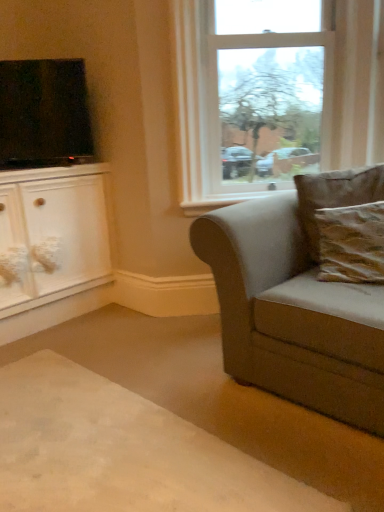
Where is `matte black tv at upper left`? The height and width of the screenshot is (512, 384). matte black tv at upper left is located at coordinates (44, 114).

Find the location of a particular element. This screenshot has height=512, width=384. clear glass window at upper center is located at coordinates (254, 95).

Find the location of a particular element. The width and height of the screenshot is (384, 512). white fabric drawer at lower left is located at coordinates (13, 251).

The width and height of the screenshot is (384, 512). Identify the location of brown textured pillow at right, the 2th pillow positioned from the back. (351, 243).

The height and width of the screenshot is (512, 384). In order to click on carpet at lower left in this screenshot , I will do `click(123, 451)`.

The width and height of the screenshot is (384, 512). What do you see at coordinates (123, 451) in the screenshot? I see `carpet at lower left` at bounding box center [123, 451].

The width and height of the screenshot is (384, 512). I want to click on brown textured pillow at right, which appears as the first pillow when viewed from the back, so click(x=335, y=196).

At what (x,y) coordinates should I click in order to perform the action: click on matte black tv at upper left. Please return your answer as a coordinate pair (x, y). This screenshot has height=512, width=384. Looking at the image, I should click on (44, 114).

Is clear glass window at upper center shorter than suede-like gray couch at right?

In fact, clear glass window at upper center may be taller than suede-like gray couch at right.

Find the location of a particular element. The width and height of the screenshot is (384, 512). studio couch in front of the clear glass window at upper center is located at coordinates (297, 301).

Choose the correct answer: Is clear glass window at upper center inside suede-like gray couch at right or outside it?

clear glass window at upper center is not enclosed by suede-like gray couch at right.

Could you tell me if white glossy cabinet at left is turned towards carpet at lower left?

Yes, white glossy cabinet at left is turned towards carpet at lower left.

Does white glossy cabinet at left touch carpet at lower left?

No.

Is point (95, 257) positioned after point (11, 412)?

That is True.

Does white glossy cabinet at left lie in front of carpet at lower left?

No, white glossy cabinet at left is further to the viewer.

In the scene shown: Do you think brown textured pillow at right, the 2th pillow positioned from the back, is within brown textured pillow at right, which appears as the first pillow when viewed from the back, or outside of it?

brown textured pillow at right, the 2th pillow positioned from the back, is contained in brown textured pillow at right, which appears as the first pillow when viewed from the back.

Is brown textured pillow at right, the 2th pillow positioned from the back, oriented towards brown textured pillow at right, which appears as the second pillow when viewed from the front?

No.

Does point (229, 17) appear closer or farther from the camera than point (332, 187)?

Point (229, 17).

Is clear glass window at upper center positioned in front of brown textured pillow at right, which appears as the second pillow when viewed from the front?

No, clear glass window at upper center is behind brown textured pillow at right, which appears as the second pillow when viewed from the front.

Is clear glass window at upper center not within brown textured pillow at right, which appears as the second pillow when viewed from the front?

clear glass window at upper center lies outside brown textured pillow at right, which appears as the second pillow when viewed from the front,'s area.

Based on the photo, is clear glass window at upper center to the right of brown textured pillow at right, which appears as the first pillow when viewed from the back, from the viewer's perspective?

No, clear glass window at upper center is not to the right of brown textured pillow at right, which appears as the first pillow when viewed from the back.

From a real-world perspective, does brown textured pillow at right, which appears as the second pillow when viewed from the front, sit lower than clear glass window at upper center?

Yes.

Measure the distance between brown textured pillow at right, which appears as the first pillow when viewed from the back, and clear glass window at upper center.

brown textured pillow at right, which appears as the first pillow when viewed from the back, is 29.28 inches away from clear glass window at upper center.

In terms of height, does brown textured pillow at right, which appears as the second pillow when viewed from the front, look taller or shorter compared to clear glass window at upper center?

Considering their sizes, brown textured pillow at right, which appears as the second pillow when viewed from the front, has less height than clear glass window at upper center.

Considering the sizes of brown textured pillow at right, which appears as the first pillow when viewed from the back, and clear glass window at upper center in the image, is brown textured pillow at right, which appears as the first pillow when viewed from the back, wider or thinner than clear glass window at upper center?

In the image, brown textured pillow at right, which appears as the first pillow when viewed from the back, appears to be wider than clear glass window at upper center.

Looking at this image, which object is more forward, brown textured pillow at right, the 2th pillow positioned from the back, or white fabric drawer at lower left?

brown textured pillow at right, the 2th pillow positioned from the back, is closer to the camera.

Find the location of a particular element. This screenshot has height=512, width=384. drawer behind the brown textured pillow at right, which is the first pillow in front-to-back order is located at coordinates (13, 251).

Is brown textured pillow at right, the 2th pillow positioned from the back, wider or thinner than white fabric drawer at lower left?

Clearly, brown textured pillow at right, the 2th pillow positioned from the back, has more width compared to white fabric drawer at lower left.

Is brown textured pillow at right, which is the first pillow in front-to-back order, beside white fabric drawer at lower left?

No, brown textured pillow at right, which is the first pillow in front-to-back order, is not next to white fabric drawer at lower left.

Which object is positioned more to the right, matte black tv at upper left or brown textured pillow at right, which is the first pillow in front-to-back order?

From the viewer's perspective, brown textured pillow at right, which is the first pillow in front-to-back order, appears more on the right side.

Can you tell me how much matte black tv at upper left and brown textured pillow at right, the 2th pillow positioned from the back, differ in facing direction?

They differ by 24.5 degrees in their facing directions.

Which object is further away from the camera, matte black tv at upper left or brown textured pillow at right, the 2th pillow positioned from the back?

matte black tv at upper left is behind.

Is matte black tv at upper left bigger or smaller than brown textured pillow at right, which is the first pillow in front-to-back order?

Considering their sizes, matte black tv at upper left takes up more space than brown textured pillow at right, which is the first pillow in front-to-back order.

Locate an element on the screen. Image resolution: width=384 pixels, height=512 pixels. window to the left of suede-like gray couch at right is located at coordinates (254, 95).

Locate an element on the screen. This screenshot has width=384, height=512. plain below the white glossy cabinet at left (from the image's perspective) is located at coordinates (123, 451).

Based on their spatial positions, is suede-like gray couch at right or matte black tv at upper left closer to clear glass window at upper center?

The object closer to clear glass window at upper center is suede-like gray couch at right.

From the image, which object appears to be farther from white fabric drawer at lower left, brown textured pillow at right, which appears as the second pillow when viewed from the front, or white glossy cabinet at left?

brown textured pillow at right, which appears as the second pillow when viewed from the front.

Consider the image. When comparing their distances from white glossy cabinet at left, does white fabric drawer at lower left or matte black tv at upper left seem closer?

white fabric drawer at lower left.

Based on their spatial positions, is carpet at lower left or white fabric drawer at lower left closer to brown textured pillow at right, the 2th pillow positioned from the back?

carpet at lower left is closer to brown textured pillow at right, the 2th pillow positioned from the back.

Based on their spatial positions, is white fabric drawer at lower left or suede-like gray couch at right closer to white glossy cabinet at left?

white fabric drawer at lower left lies closer to white glossy cabinet at left than the other object.

When comparing their distances from matte black tv at upper left, does suede-like gray couch at right or brown textured pillow at right, which appears as the first pillow when viewed from the back, seem closer?

Among the two, suede-like gray couch at right is located nearer to matte black tv at upper left.

Estimate the real-world distances between objects in this image. Which object is closer to clear glass window at upper center, matte black tv at upper left or brown textured pillow at right, which is the first pillow in front-to-back order?

matte black tv at upper left lies closer to clear glass window at upper center than the other object.

When comparing their distances from matte black tv at upper left, does clear glass window at upper center or suede-like gray couch at right seem further?

suede-like gray couch at right is positioned further to the anchor matte black tv at upper left.

The image size is (384, 512). In order to click on television between white fabric drawer at lower left and clear glass window at upper center from left to right in this screenshot , I will do `click(44, 114)`.

The width and height of the screenshot is (384, 512). I want to click on window between white glossy cabinet at left and brown textured pillow at right, which appears as the second pillow when viewed from the front, from left to right, so (x=254, y=95).

Where is `plain between white glossy cabinet at left and brown textured pillow at right, which appears as the second pillow when viewed from the front`? The width and height of the screenshot is (384, 512). plain between white glossy cabinet at left and brown textured pillow at right, which appears as the second pillow when viewed from the front is located at coordinates (123, 451).

Locate an element on the screen. pillow between white glossy cabinet at left and brown textured pillow at right, which appears as the first pillow when viewed from the back, from left to right is located at coordinates (351, 243).